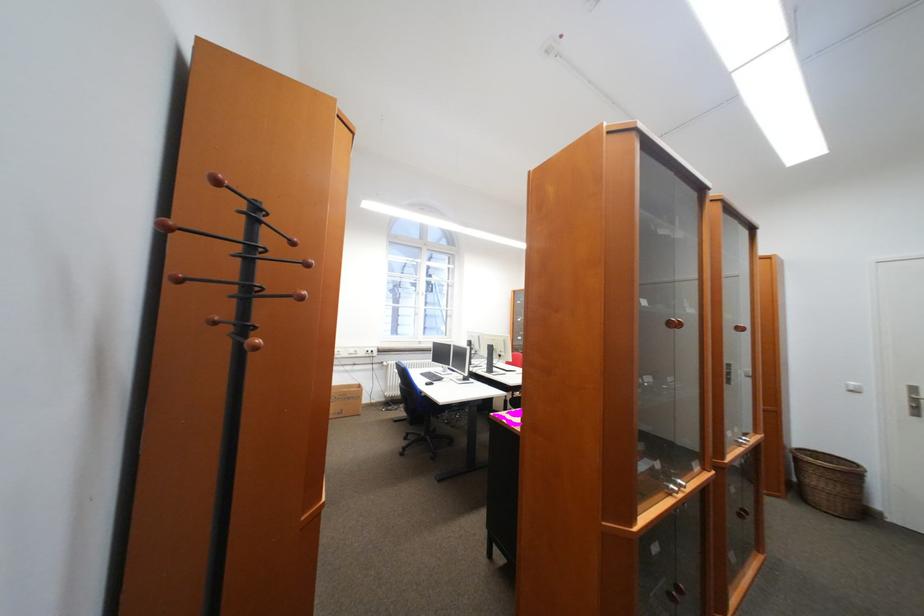
What do you see at coordinates (419, 413) in the screenshot? I see `the chair armrest` at bounding box center [419, 413].